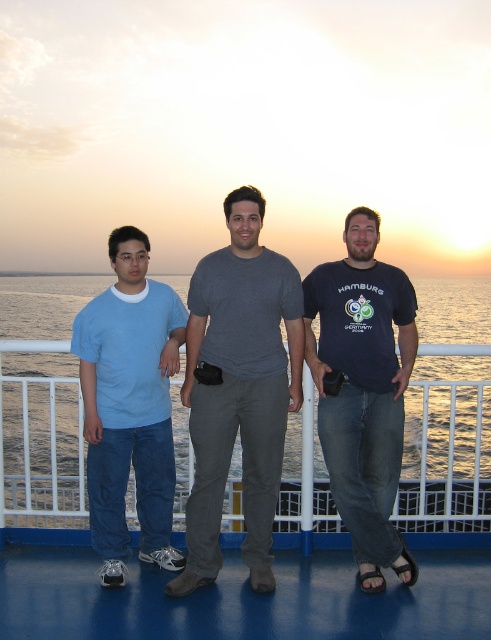
Question: Can you confirm if dark blue t-shirt at center is wider than light blue t-shirt at left?

Choices:
 (A) no
 (B) yes

Answer: (B)

Question: Is dark blue t-shirt at center smaller than light blue t-shirt at left?

Choices:
 (A) no
 (B) yes

Answer: (A)

Question: Based on their relative distances, which object is farther from the dark blue t-shirt at center?

Choices:
 (A) light blue t-shirt at left
 (B) gray cotton t-shirt at center

Answer: (A)

Question: Which point is farther to the camera?

Choices:
 (A) blue water at center
 (B) dark blue t-shirt at center
 (C) gray cotton t-shirt at center
 (D) light blue t-shirt at left

Answer: (A)

Question: Which point is farther from the camera taking this photo?

Choices:
 (A) (128, 323)
 (B) (414, 420)

Answer: (B)

Question: Is blue water at center bigger than light blue t-shirt at left?

Choices:
 (A) yes
 (B) no

Answer: (A)